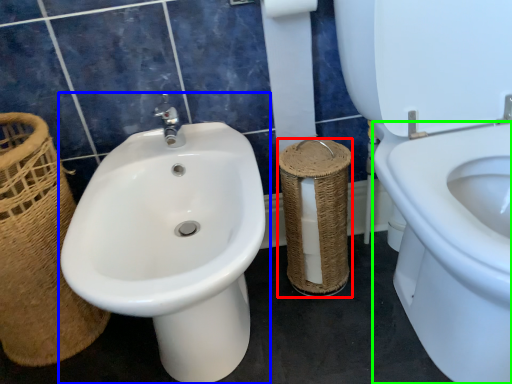
Question: Which object is positioned farthest from basket container (highlighted by a red box)? Select from sink (highlighted by a blue box) and bidet (highlighted by a green box).

Choices:
 (A) sink
 (B) bidet

Answer: (A)